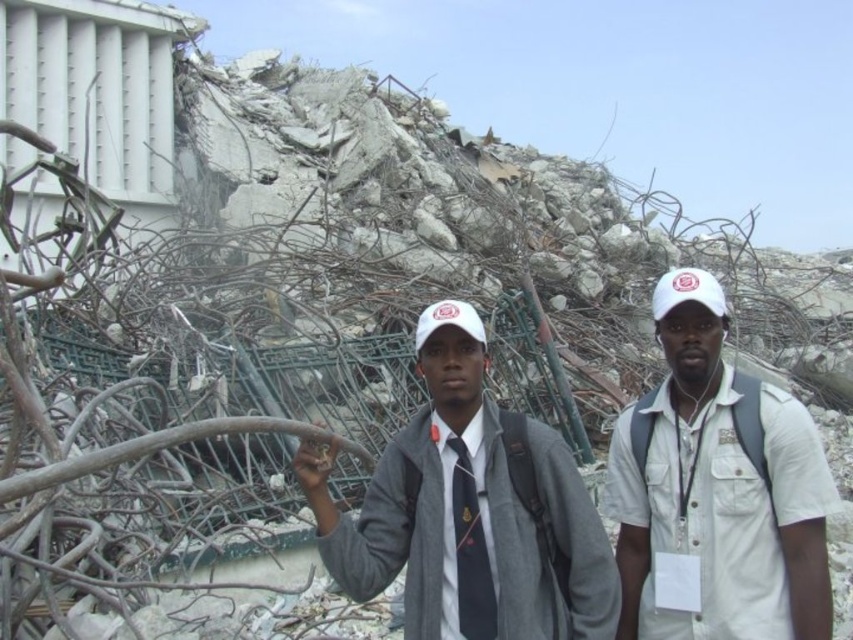
Question: Does white cotton cap at center have a lesser width compared to matte gray jacket at center?

Choices:
 (A) yes
 (B) no

Answer: (A)

Question: Is white cotton cap at center further to camera compared to matte gray jacket at center?

Choices:
 (A) no
 (B) yes

Answer: (A)

Question: Is white cotton cap at center below matte gray jacket at center?

Choices:
 (A) yes
 (B) no

Answer: (B)